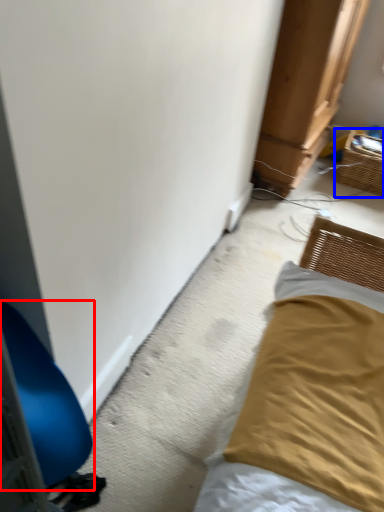
Question: Which object is further to the camera taking this photo, furniture (highlighted by a red box) or basket (highlighted by a blue box)?

Choices:
 (A) furniture
 (B) basket

Answer: (B)